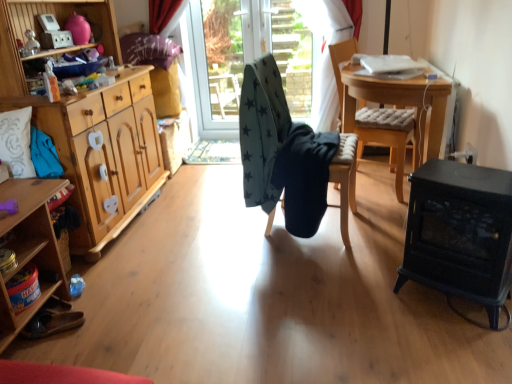
You are a GUI agent. You are given a task and a screenshot of the screen. Output one action in this format:
    pyautogui.click(x=<x>, y=<y>)
    Task: Click on the free space below black cast iron fireplace at lower right (from a real-world perspective)
    Image resolution: width=512 pixels, height=384 pixels.
    Given the screenshot: What is the action you would take?
    pyautogui.click(x=445, y=301)